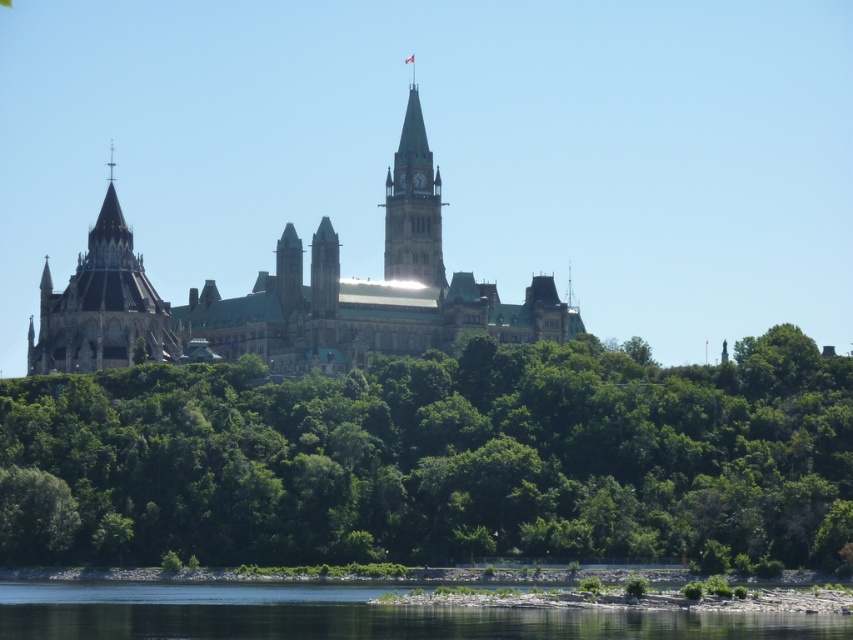
Question: Does transparent water at lower center lie in front of green stone clock tower at center?

Choices:
 (A) no
 (B) yes

Answer: (B)

Question: Which of the following is the closest to the observer?

Choices:
 (A) transparent water at lower center
 (B) dark brown stone tower at left

Answer: (A)

Question: Is green slate roof at center to the right of transparent water at lower center from the viewer's perspective?

Choices:
 (A) no
 (B) yes

Answer: (A)

Question: Which of the following is the closest to the observer?

Choices:
 (A) green slate roof at center
 (B) green stone clock tower at center
 (C) green leafy trees at center
 (D) dark brown stone tower at left

Answer: (C)

Question: Is green slate roof at center positioned in front of dark brown stone tower at left?

Choices:
 (A) no
 (B) yes

Answer: (A)

Question: Among these points, which one is nearest to the camera?

Choices:
 (A) (155, 353)
 (B) (132, 394)

Answer: (B)